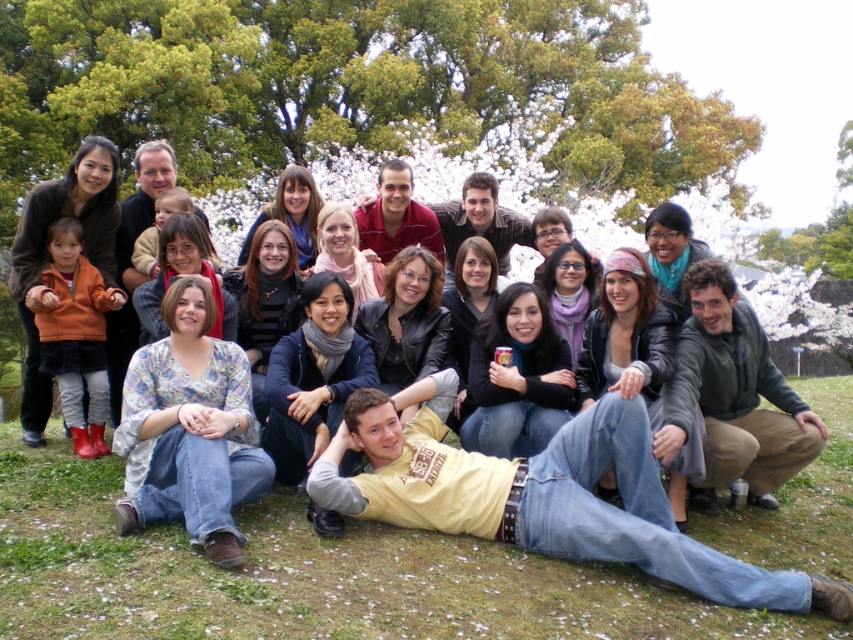
In the scene shown: Who is more distant from viewer, (x=373, y=611) or (x=699, y=397)?

The point (x=699, y=397) is behind.

Is point (537, 605) more distant than point (689, 374)?

No, (537, 605) is in front of (689, 374).

Where is `green grass at lower center`? The height and width of the screenshot is (640, 853). green grass at lower center is located at coordinates (308, 576).

Which is below, dark gray fleece jacket at lower right or matte black jacket at center?

dark gray fleece jacket at lower right is lower down.

Is point (787, 390) closer to viewer compared to point (303, 212)?

Yes, point (787, 390) is in front of point (303, 212).

Is point (782, 444) positioned after point (309, 195)?

No.

Locate an element on the screen. Image resolution: width=853 pixels, height=640 pixels. dark gray fleece jacket at lower right is located at coordinates (732, 396).

Between point (242, 394) and point (32, 237), which one is positioned behind?

The point (32, 237) is more distant.

At what (x,y) coordinates should I click in order to perform the action: click on floral-patterned blouse at center. Please return your answer as a coordinate pair (x, y). Looking at the image, I should click on (190, 429).